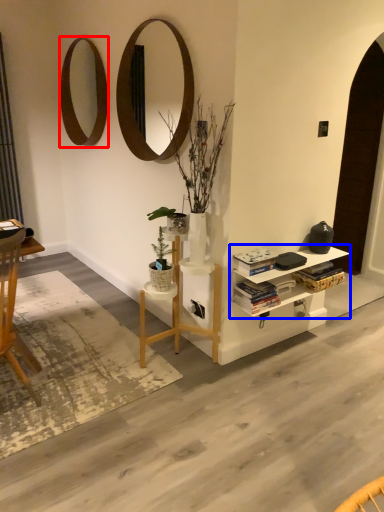
Question: Which object is closer to the camera taking this photo, mirror (highlighted by a red box) or shelf (highlighted by a blue box)?

Choices:
 (A) mirror
 (B) shelf

Answer: (B)